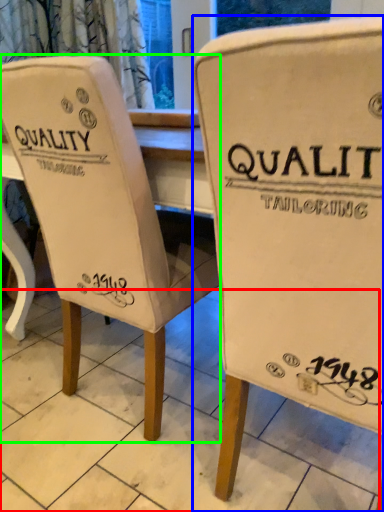
Question: Which object is the closest to the tile (highlighted by a red box)? Choose among these: chair (highlighted by a blue box) or chair (highlighted by a green box).

Choices:
 (A) chair
 (B) chair

Answer: (B)